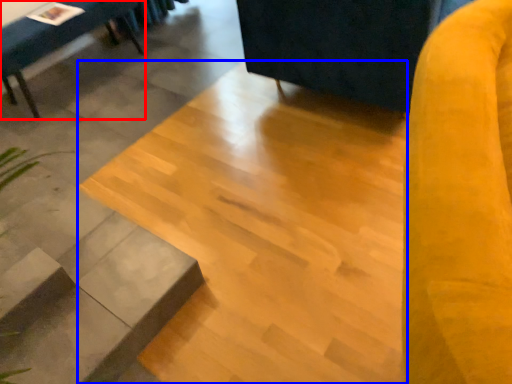
Question: Which object appears closest to the camera in this image, furniture (highlighted by a red box) or concrete (highlighted by a blue box)?

Choices:
 (A) furniture
 (B) concrete

Answer: (B)